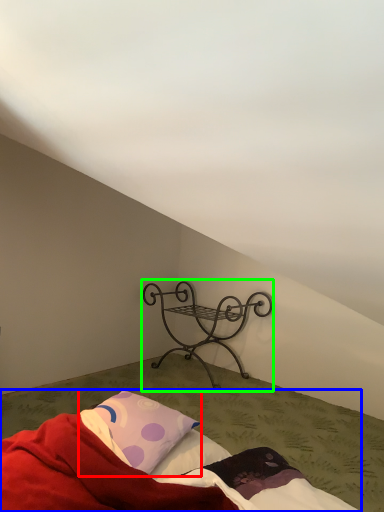
Question: Based on their relative distances, which object is farther from pillow (highlighted by a red box)? Choose from bed (highlighted by a blue box) and furniture (highlighted by a green box).

Choices:
 (A) bed
 (B) furniture

Answer: (B)